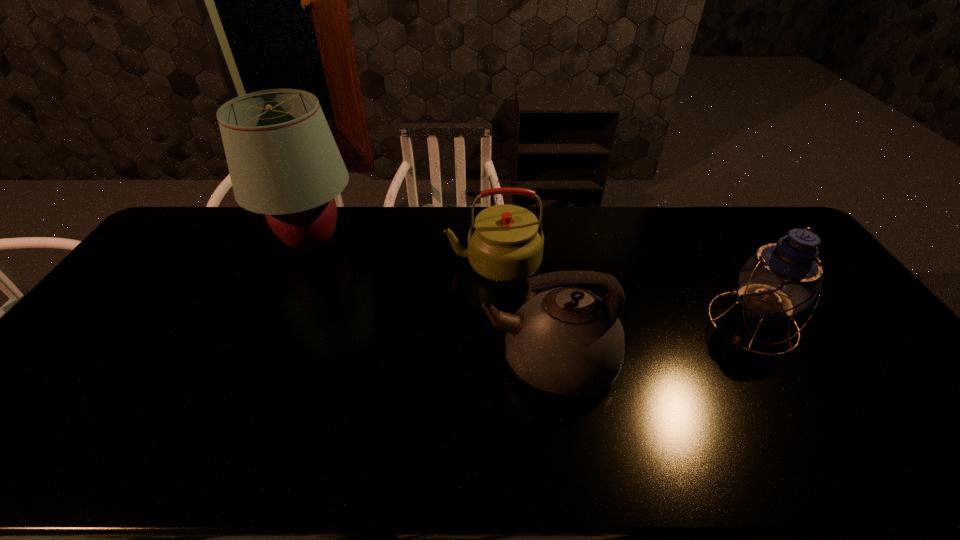
Find the location of `vacant space located at the spout of the farther kettle`. vacant space located at the spout of the farther kettle is located at coordinates (375, 262).

I want to click on vacant space located at the spout of the farther kettle, so click(x=412, y=262).

Locate an element on the screen. free spot located at the spout of the farther kettle is located at coordinates (342, 262).

Locate an element on the screen. The width and height of the screenshot is (960, 540). vacant space situated 0.210m on the back of the shortest object is located at coordinates (226, 328).

In order to click on lampshade present at the far edge in this screenshot , I will do `click(283, 161)`.

Where is `kettle present at the far edge`? The width and height of the screenshot is (960, 540). kettle present at the far edge is located at coordinates (505, 244).

At what (x,y) coordinates should I click in order to perform the action: click on free point at the far edge. Please return your answer as a coordinate pair (x, y). This screenshot has height=540, width=960. Looking at the image, I should click on (627, 233).

Image resolution: width=960 pixels, height=540 pixels. What are the coordinates of `vacant space at the near edge of the desktop` in the screenshot? It's located at (272, 446).

This screenshot has width=960, height=540. Identify the location of vacant space at the left edge of the desktop. (134, 305).

I want to click on vacant space at the right edge of the desktop, so click(901, 395).